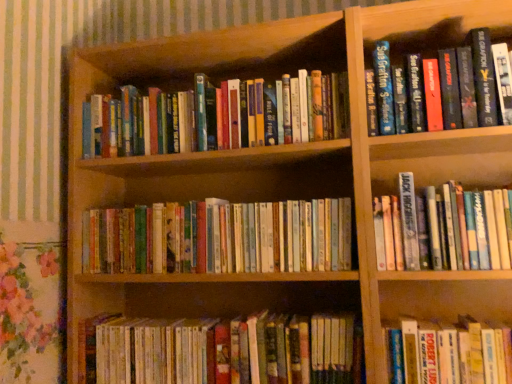
The width and height of the screenshot is (512, 384). What do you see at coordinates (426, 41) in the screenshot? I see `hardcover book at upper right, the 1th book when ordered from top to bottom` at bounding box center [426, 41].

The height and width of the screenshot is (384, 512). What do you see at coordinates (449, 353) in the screenshot? I see `hardcover book at lower right, the 2th book in the bottom-to-top sequence` at bounding box center [449, 353].

Where is `hardcover books at lower center, which ranks as the 6th book in top-to-bottom order`? The width and height of the screenshot is (512, 384). hardcover books at lower center, which ranks as the 6th book in top-to-bottom order is located at coordinates (224, 350).

From a real-world perspective, who is located higher, white paperback book at right, arranged as the third book when viewed from the top, or hardcover books at center, the third book positioned from the bottom?

→ From a 3D spatial view, white paperback book at right, arranged as the third book when viewed from the top, is above.

Does point (466, 229) appear closer or farther from the camera than point (204, 252)?

Point (466, 229) is positioned closer to the camera compared to point (204, 252).

Does white paperback book at right, the 4th book positioned from the bottom, touch hardcover books at center, placed as the fourth book when sorted from top to bottom?

No, white paperback book at right, the 4th book positioned from the bottom, is not making contact with hardcover books at center, placed as the fourth book when sorted from top to bottom.

Based on the photo, which object is positioned more to the left, white paperback book at right, arranged as the third book when viewed from the top, or hardcover books at center, placed as the fourth book when sorted from top to bottom?

hardcover books at center, placed as the fourth book when sorted from top to bottom.

Is hardcover books at lower center, which ranks as the 6th book in top-to-bottom order, next to white paperback book at right, arranged as the third book when viewed from the top, and touching it?

hardcover books at lower center, which ranks as the 6th book in top-to-bottom order, and white paperback book at right, arranged as the third book when viewed from the top, are clearly separated.

Between hardcover books at lower center, which is counted as the 1th book, starting from the bottom, and white paperback book at right, the 4th book positioned from the bottom, which one appears on the right side from the viewer's perspective?

Positioned to the right is white paperback book at right, the 4th book positioned from the bottom.

Can you confirm if hardcover books at lower center, which ranks as the 6th book in top-to-bottom order, is wider than white paperback book at right, arranged as the third book when viewed from the top?

Yes.

From the image's perspective, is hardcover books at lower center, which ranks as the 6th book in top-to-bottom order, beneath white paperback book at right, arranged as the third book when viewed from the top?

Indeed, from the image's perspective, hardcover books at lower center, which ranks as the 6th book in top-to-bottom order, is shown beneath white paperback book at right, arranged as the third book when viewed from the top.

Considering the relative sizes of hardcover books at center, placed as the fourth book when sorted from top to bottom, and hardcover book at lower right, which is counted as the fifth book, starting from the top, in the image provided, is hardcover books at center, placed as the fourth book when sorted from top to bottom, shorter than hardcover book at lower right, which is counted as the fifth book, starting from the top,?

Yes.

From the image's perspective, is hardcover books at center, the third book positioned from the bottom, located beneath hardcover book at lower right, the 2th book in the bottom-to-top sequence?

No, from the image's perspective, hardcover books at center, the third book positioned from the bottom, is not below hardcover book at lower right, the 2th book in the bottom-to-top sequence.

Which is in front, point (315, 234) or point (422, 378)?

The point (422, 378) is closer.

How far apart are hardcover books at center, placed as the fourth book when sorted from top to bottom, and hardcover book at lower right, which is counted as the fifth book, starting from the top?

hardcover books at center, placed as the fourth book when sorted from top to bottom, is 16.83 inches away from hardcover book at lower right, which is counted as the fifth book, starting from the top.

Is hardcover books at center, placed as the fourth book when sorted from top to bottom, to the left of white paperback book at right, arranged as the third book when viewed from the top, from the viewer's perspective?

Correct, you'll find hardcover books at center, placed as the fourth book when sorted from top to bottom, to the left of white paperback book at right, arranged as the third book when viewed from the top.

Are hardcover books at center, the third book positioned from the bottom, and white paperback book at right, arranged as the third book when viewed from the top, beside each other?

hardcover books at center, the third book positioned from the bottom, is not next to white paperback book at right, arranged as the third book when viewed from the top, and they're not touching.

In terms of height, does hardcover books at center, placed as the fourth book when sorted from top to bottom, look taller or shorter compared to white paperback book at right, arranged as the third book when viewed from the top?

Clearly, hardcover books at center, placed as the fourth book when sorted from top to bottom, is shorter compared to white paperback book at right, arranged as the third book when viewed from the top.

From the image's perspective, relative to hardcover book at lower right, the 2th book in the bottom-to-top sequence, is hardcover books at lower center, which ranks as the 6th book in top-to-bottom order, above or below?

hardcover books at lower center, which ranks as the 6th book in top-to-bottom order, is situated lower than hardcover book at lower right, the 2th book in the bottom-to-top sequence, in the image.

This screenshot has width=512, height=384. I want to click on the 1st book counting from the right of the hardcover books at lower center, which is counted as the 1th book, starting from the bottom, so click(449, 353).

From a real-world perspective, who is located higher, hardcover books at lower center, which is counted as the 1th book, starting from the bottom, or hardcover book at lower right, the 2th book in the bottom-to-top sequence?

hardcover book at lower right, the 2th book in the bottom-to-top sequence, from a real-world perspective.

Which object is further away from the camera, hardcover books at center, the second book from the top, or hardcover book at lower right, the 2th book in the bottom-to-top sequence?

hardcover books at center, the second book from the top, is further away from the camera.

Image resolution: width=512 pixels, height=384 pixels. I want to click on book that is the 3rd object located below the hardcover books at center, the second book from the top (from the image's perspective), so click(449, 353).

How many degrees apart are the facing directions of hardcover books at center, the fifth book ordered from the bottom, and hardcover book at lower right, which is counted as the fifth book, starting from the top?

The angular difference between hardcover books at center, the fifth book ordered from the bottom, and hardcover book at lower right, which is counted as the fifth book, starting from the top, is 0.00189 degrees.

How distant is hardcover book at upper right, positioned as the sixth book in bottom-to-top order, from hardcover book at lower right, which is counted as the fifth book, starting from the top?

They are 24.06 inches apart.

How different are the orientations of hardcover book at upper right, positioned as the sixth book in bottom-to-top order, and hardcover book at lower right, the 2th book in the bottom-to-top sequence, in degrees?

hardcover book at upper right, positioned as the sixth book in bottom-to-top order, and hardcover book at lower right, the 2th book in the bottom-to-top sequence, are facing 0.00177 degrees away from each other.

Is hardcover book at upper right, positioned as the sixth book in bottom-to-top order, in front of or behind hardcover book at lower right, which is counted as the fifth book, starting from the top, in the image?

hardcover book at upper right, positioned as the sixth book in bottom-to-top order, is behind hardcover book at lower right, which is counted as the fifth book, starting from the top.

Does hardcover book at upper right, the 1th book when ordered from top to bottom, have a smaller size compared to hardcover book at lower right, which is counted as the fifth book, starting from the top?

Actually, hardcover book at upper right, the 1th book when ordered from top to bottom, might be larger than hardcover book at lower right, which is counted as the fifth book, starting from the top.

Identify the location of book that is the 3rd object to the right of the hardcover books at center, the third book positioned from the bottom, starting at the anchor. (469, 228).

From the image's perspective, starting from the hardcover books at lower center, which is counted as the 1th book, starting from the bottom, which book is the 3rd one above? Please provide its 2D coordinates.

[(469, 228)]

Which object lies nearer to the anchor point hardcover books at center, the second book from the top, white paperback book at right, the 4th book positioned from the bottom, or hardcover books at center, the third book positioned from the bottom?

hardcover books at center, the third book positioned from the bottom, lies closer to hardcover books at center, the second book from the top, than the other object.

Estimate the real-world distances between objects in this image. Which object is further from hardcover book at upper right, the 1th book when ordered from top to bottom, hardcover books at center, the third book positioned from the bottom, or hardcover books at center, the fifth book ordered from the bottom?

Based on the image, hardcover books at center, the third book positioned from the bottom, appears to be further to hardcover book at upper right, the 1th book when ordered from top to bottom.

Looking at this image, looking at the image, which one is located further to white paperback book at right, arranged as the third book when viewed from the top, hardcover books at lower center, which ranks as the 6th book in top-to-bottom order, or hardcover books at center, the second book from the top?

hardcover books at center, the second book from the top, is positioned further to the anchor white paperback book at right, arranged as the third book when viewed from the top.

Looking at the image, which one is located further to hardcover books at center, the fifth book ordered from the bottom, white paperback book at right, arranged as the third book when viewed from the top, or hardcover book at lower right, the 2th book in the bottom-to-top sequence?

hardcover book at lower right, the 2th book in the bottom-to-top sequence, lies further to hardcover books at center, the fifth book ordered from the bottom, than the other object.

Which object lies further to the anchor point hardcover books at lower center, which is counted as the 1th book, starting from the bottom, hardcover book at upper right, positioned as the sixth book in bottom-to-top order, or hardcover books at center, the third book positioned from the bottom?

hardcover book at upper right, positioned as the sixth book in bottom-to-top order, is further to hardcover books at lower center, which is counted as the 1th book, starting from the bottom.

Which object lies nearer to the anchor point hardcover book at lower right, which is counted as the fifth book, starting from the top, hardcover books at lower center, which ranks as the 6th book in top-to-bottom order, or hardcover books at center, the second book from the top?

hardcover books at lower center, which ranks as the 6th book in top-to-bottom order, lies closer to hardcover book at lower right, which is counted as the fifth book, starting from the top, than the other object.

Estimate the real-world distances between objects in this image. Which object is further from hardcover books at center, placed as the fourth book when sorted from top to bottom, white paperback book at right, arranged as the third book when viewed from the top, or hardcover books at lower center, which is counted as the 1th book, starting from the bottom?

white paperback book at right, arranged as the third book when viewed from the top.

Looking at this image, based on their spatial positions, is hardcover book at lower right, which is counted as the fifth book, starting from the top, or hardcover books at center, the second book from the top, closer to hardcover books at center, placed as the fourth book when sorted from top to bottom?

Result: Among the two, hardcover books at center, the second book from the top, is located nearer to hardcover books at center, placed as the fourth book when sorted from top to bottom.

Identify the location of book situated between hardcover books at center, the third book positioned from the bottom, and hardcover book at lower right, which is counted as the fifth book, starting from the top, from left to right. Image resolution: width=512 pixels, height=384 pixels. tap(224, 350).

The height and width of the screenshot is (384, 512). I want to click on book between hardcover books at lower center, which ranks as the 6th book in top-to-bottom order, and white paperback book at right, the 4th book positioned from the bottom, in the horizontal direction, so click(449, 353).